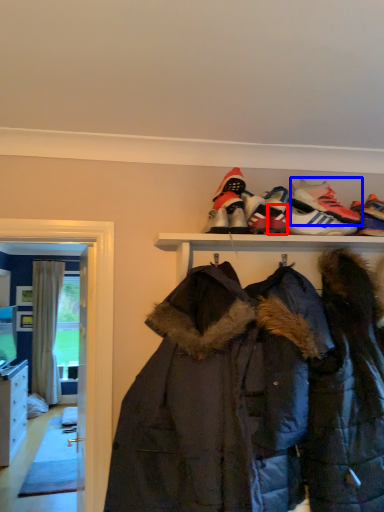
Question: Among these objects, which one is nearest to the camera, shoe (highlighted by a red box) or footwear (highlighted by a blue box)?

Choices:
 (A) shoe
 (B) footwear

Answer: (A)